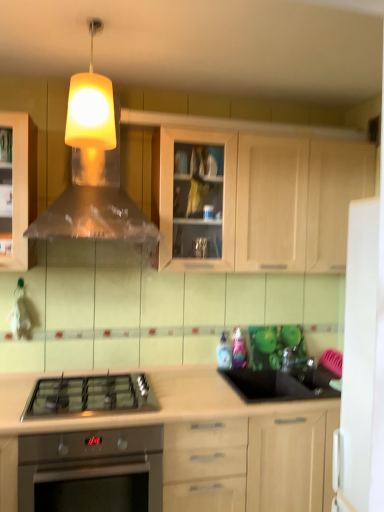
Identify the location of free spot above yellow matte lampshade at upper center (from a real-world perspective). The width and height of the screenshot is (384, 512). (93, 20).